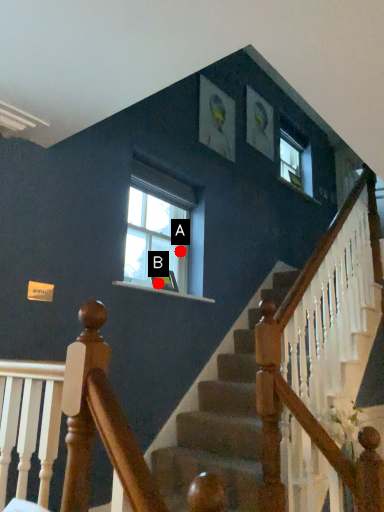
Question: Two points are circled on the image, labeled by A and B beside each circle. Among these points, which one is nearest to the camera?

Choices:
 (A) A is closer
 (B) B is closer

Answer: (B)